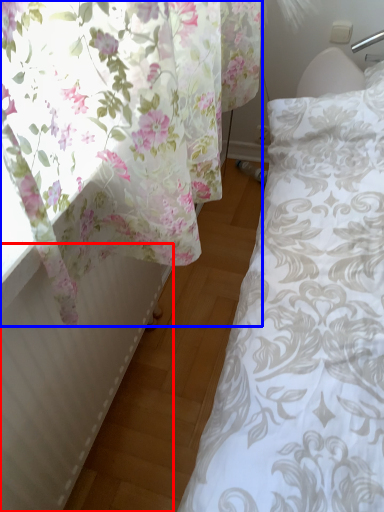
Question: Which object is closer to the camera taking this photo, radiator (highlighted by a red box) or curtain (highlighted by a blue box)?

Choices:
 (A) radiator
 (B) curtain

Answer: (A)